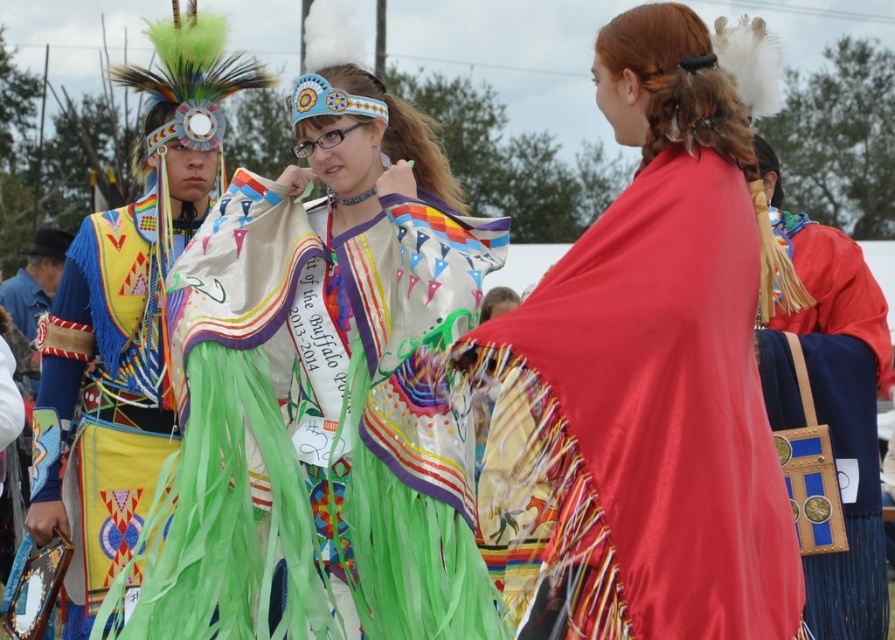
Looking at this image, is shiny satin dress at center closer to the viewer compared to blue leather bag at right?

That is True.

Between shiny satin dress at center and blue leather bag at right, which one appears on the right side from the viewer's perspective?

blue leather bag at right is more to the right.

Measure the distance between shiny satin dress at center and camera.

shiny satin dress at center and camera are 21.04 meters apart.

The width and height of the screenshot is (895, 640). Find the location of `shiny satin dress at center`. shiny satin dress at center is located at coordinates 325,392.

In the scene shown: Between multicolored fabric vest at left and blue leather bag at right, which one appears on the left side from the viewer's perspective?

multicolored fabric vest at left

Does multicolored fabric vest at left have a greater height compared to blue leather bag at right?

Correct, multicolored fabric vest at left is much taller as blue leather bag at right.

Is point (87, 493) positioned before point (849, 582)?

No, (87, 493) is further to viewer.

Where is `multicolored fabric vest at left`? This screenshot has height=640, width=895. multicolored fabric vest at left is located at coordinates (107, 387).

Which is behind, point (465, 481) or point (692, 376)?

Point (465, 481)

Does shiny satin dress at center have a greater width compared to shiny red cape at center?

Yes.

Which is in front, point (363, 182) or point (659, 88)?

Point (659, 88) is in front.

What are the coordinates of `shiny satin dress at center` in the screenshot? It's located at (325, 392).